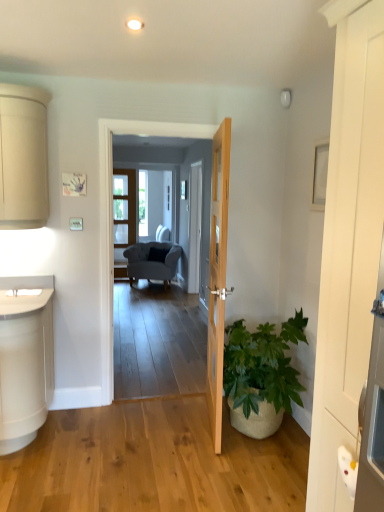
Question: Considering the positions of smooth gray carpet at center and clear glass screen door at center in the image, is smooth gray carpet at center bigger or smaller than clear glass screen door at center?

Choices:
 (A) big
 (B) small

Answer: (A)

Question: Considering the relative positions of smooth gray carpet at center and clear glass screen door at center in the image provided, is smooth gray carpet at center to the left or to the right of clear glass screen door at center?

Choices:
 (A) left
 (B) right

Answer: (B)

Question: Which object is the closest to the natural wood door at center, which ranks as the first door in back-to-front order?

Choices:
 (A) suede gray armchair at center
 (B) smooth gray carpet at center
 (C) green leafy plant in woven basket at lower right
 (D) clear glass screen door at center
 (E) white wooden door at right, which appears as the 1th door when viewed from the front

Answer: (C)

Question: Based on their relative distances, which object is nearer to the smooth gray carpet at center?

Choices:
 (A) natural wood door at center, which ranks as the first door in back-to-front order
 (B) suede gray armchair at center
 (C) green leafy plant in woven basket at lower right
 (D) white wooden door at right, which appears as the 1th door when viewed from the front
 (E) clear glass screen door at center

Answer: (A)